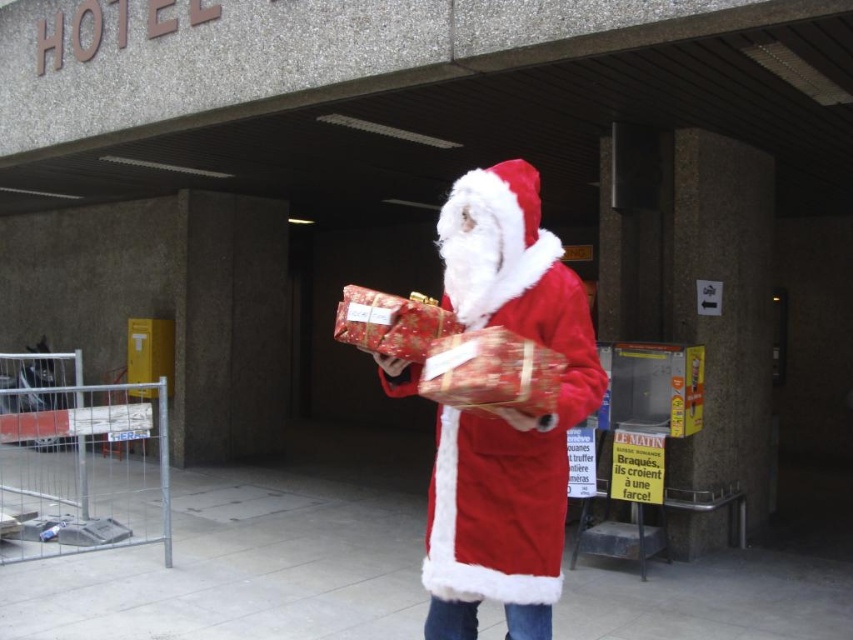
Based on the photo, you are a photographer trying to capture the Santa figure in the scene. Since you want to focus on the fuzzy red coat at center and the shiny red wrapping paper at center, which one should you adjust your camera focus to first if the coat is closer to the bottom of the frame?

The fuzzy red coat at center is below the shiny red wrapping paper at center, so you should focus on the fuzzy red coat at center first as it is lower in the frame.

You are a delivery person who needs to place a package on a shelf. The shelf is 10 inches wide. Can the package fit between the fuzzy red coat at center and the shiny red wrapping paper at center?

The distance between the fuzzy red coat at center and the shiny red wrapping paper at center is 10.67 inches, so the package can fit as the distance is slightly larger than the shelf width.